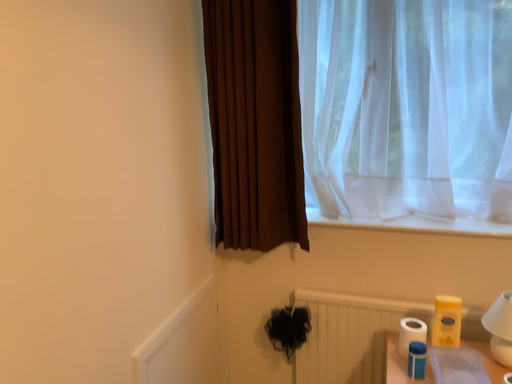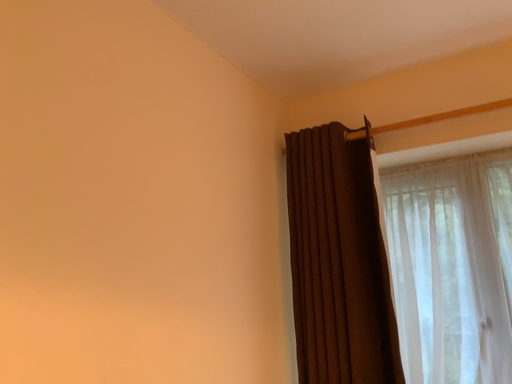
Question: Which way did the camera rotate in the video?

Choices:
 (A) rotated right
 (B) rotated left

Answer: (B)